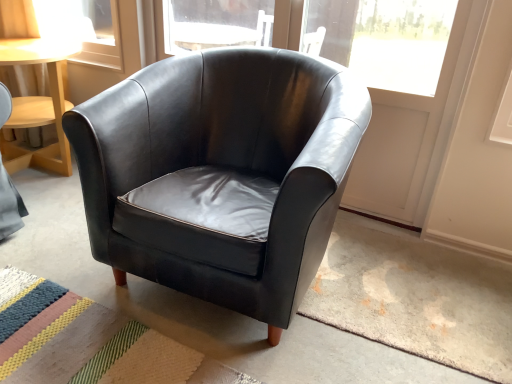
Image resolution: width=512 pixels, height=384 pixels. I want to click on striped woven mat at lower left, so click(x=89, y=342).

The image size is (512, 384). What do you see at coordinates (89, 342) in the screenshot?
I see `striped woven mat at lower left` at bounding box center [89, 342].

At what (x,y) coordinates should I click in order to perform the action: click on black leather armchair at center. Please return your answer as a coordinate pair (x, y). This screenshot has width=512, height=384. Looking at the image, I should click on click(x=221, y=174).

This screenshot has height=384, width=512. What do you see at coordinates (221, 174) in the screenshot?
I see `black leather armchair at center` at bounding box center [221, 174].

The width and height of the screenshot is (512, 384). Find the location of `striped woven mat at lower left`. striped woven mat at lower left is located at coordinates (89, 342).

Would you say striped woven mat at lower left is to the left or to the right of black leather armchair at center in the picture?

In the image, striped woven mat at lower left appears on the left side of black leather armchair at center.

Which is in front, striped woven mat at lower left or black leather armchair at center?

black leather armchair at center is closer to the camera.

Is point (45, 368) closer or farther from the camera than point (105, 112)?

Clearly, point (45, 368) is closer to the camera than point (105, 112).

From the image's perspective, would you say striped woven mat at lower left is positioned over black leather armchair at center?

Actually, striped woven mat at lower left appears below black leather armchair at center in the image.

From a real-world perspective, does striped woven mat at lower left stand above black leather armchair at center?

No, from a real-world perspective, striped woven mat at lower left is not above black leather armchair at center.

Looking at this image, considering the sizes of objects striped woven mat at lower left and black leather armchair at center in the image provided, who is thinner, striped woven mat at lower left or black leather armchair at center?

With smaller width is black leather armchair at center.

Between striped woven mat at lower left and black leather armchair at center, which one has less height?

striped woven mat at lower left.

Between striped woven mat at lower left and black leather armchair at center, which one has smaller size?

Smaller between the two is striped woven mat at lower left.

Would you say black leather armchair at center is part of striped woven mat at lower left's contents?

Actually, black leather armchair at center is outside striped woven mat at lower left.

Is striped woven mat at lower left not near black leather armchair at center?

That's not correct — striped woven mat at lower left is a little close to black leather armchair at center.

Could you tell me if striped woven mat at lower left is turned towards black leather armchair at center?

No, striped woven mat at lower left is not turned towards black leather armchair at center.

What's the angular difference between striped woven mat at lower left and black leather armchair at center's facing directions?

The angular difference between striped woven mat at lower left and black leather armchair at center is 88.3 degrees.

Locate an element on the screen. This screenshot has height=384, width=512. chair on the right of the striped woven mat at lower left is located at coordinates (221, 174).

Which is more to the right, black leather armchair at center or striped woven mat at lower left?

From the viewer's perspective, black leather armchair at center appears more on the right side.

Consider the image. Which object is closer to the camera taking this photo, black leather armchair at center or striped woven mat at lower left?

black leather armchair at center is more forward.

Which is behind, point (297, 225) or point (4, 369)?

Positioned behind is point (4, 369).

From the image's perspective, which is above, black leather armchair at center or striped woven mat at lower left?

black leather armchair at center appears higher in the image.

From a real-world perspective, is black leather armchair at center located beneath striped woven mat at lower left?

Incorrect, from a real-world perspective, black leather armchair at center is higher than striped woven mat at lower left.

Does black leather armchair at center have a lesser width compared to striped woven mat at lower left?

Yes.

Considering the relative sizes of black leather armchair at center and striped woven mat at lower left in the image provided, is black leather armchair at center shorter than striped woven mat at lower left?

Incorrect, the height of black leather armchair at center does not fall short of that of striped woven mat at lower left.

In terms of size, does black leather armchair at center appear bigger or smaller than striped woven mat at lower left?

Considering their sizes, black leather armchair at center takes up more space than striped woven mat at lower left.

Is black leather armchair at center situated inside striped woven mat at lower left or outside?

black leather armchair at center exists outside the volume of striped woven mat at lower left.

Is there a large distance between black leather armchair at center and striped woven mat at lower left?

Actually, black leather armchair at center and striped woven mat at lower left are a little close together.

Does black leather armchair at center turn towards striped woven mat at lower left?

Yes, black leather armchair at center faces towards striped woven mat at lower left.

How many degrees apart are the facing directions of black leather armchair at center and striped woven mat at lower left?

There is a 88.3-degree angle between the facing directions of black leather armchair at center and striped woven mat at lower left.

In order to click on chair above the striped woven mat at lower left (from a real-world perspective) in this screenshot , I will do `click(221, 174)`.

The height and width of the screenshot is (384, 512). What are the coordinates of `mat directly beneath the black leather armchair at center (from a real-world perspective)` in the screenshot? It's located at (89, 342).

Locate an element on the screen. The image size is (512, 384). mat behind the black leather armchair at center is located at coordinates (89, 342).